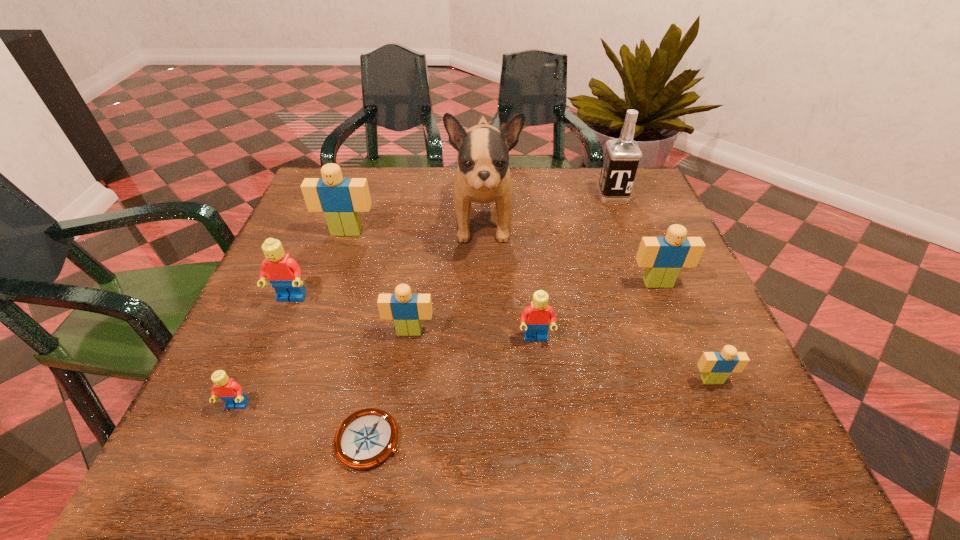
Identify the location of free space located 0.070m on the face of the fourth farthest object. The height and width of the screenshot is (540, 960). (670, 314).

I want to click on free space located on the face of the biggest red Lego, so click(x=267, y=356).

You are a GUI agent. You are given a task and a screenshot of the screen. Output one action in this format:
    pyautogui.click(x=<x>, y=<y>)
    Task: Click on the free space located 0.140m on the face of the third biggest beige Lego
    This screenshot has height=540, width=960.
    Given the screenshot: What is the action you would take?
    pyautogui.click(x=399, y=403)

Where is `vacant space situated on the face of the second smallest red Lego`? The height and width of the screenshot is (540, 960). vacant space situated on the face of the second smallest red Lego is located at coordinates (545, 427).

I want to click on vacant space located 0.070m on the face of the smallest beige Lego, so pyautogui.click(x=731, y=423).

Identify the location of vacant area located 0.050m on the face of the nearest Lego. The width and height of the screenshot is (960, 540). (221, 443).

The height and width of the screenshot is (540, 960). Identify the location of free space located on the right of the compass. (458, 440).

You are a GUI agent. You are given a task and a screenshot of the screen. Output one action in this format:
    pyautogui.click(x=<x>, y=<y>)
    Task: Click on the puppy that is at the far edge
    This screenshot has width=960, height=540.
    Given the screenshot: What is the action you would take?
    pyautogui.click(x=483, y=176)

What are the coordinates of `vodka located at the far edge` in the screenshot? It's located at (622, 155).

What are the coordinates of `object that is at the near edge` in the screenshot? It's located at (367, 437).